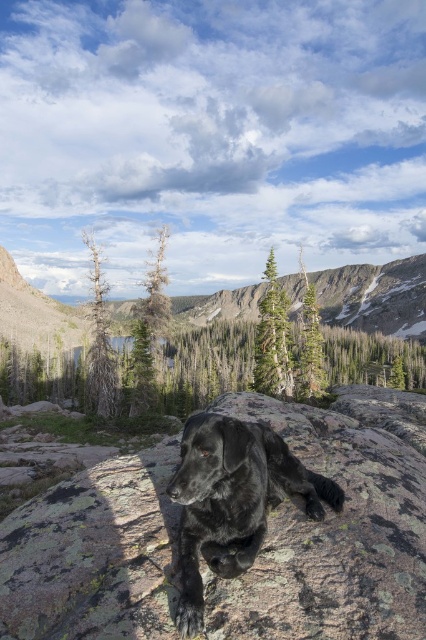
Between point (175, 515) and point (221, 465), which one is positioned in front?

Point (221, 465) is more forward.

Is rough granite boulder at center to the right of shiny black dog at center from the viewer's perspective?

Correct, you'll find rough granite boulder at center to the right of shiny black dog at center.

Is point (334, 608) closer to camera compared to point (233, 428)?

That is True.

In order to click on rough granite boulder at center in this screenshot , I will do `click(336, 525)`.